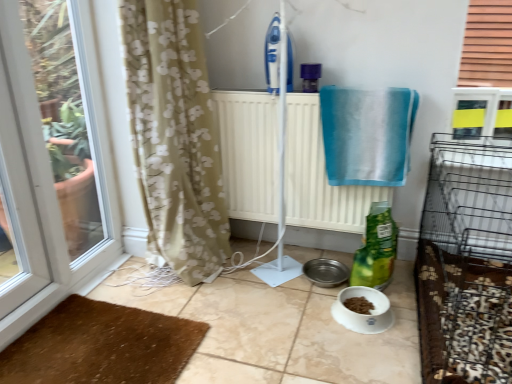
Locate an element on the screen. vacant area to the right of green matte bag at lower center is located at coordinates (401, 282).